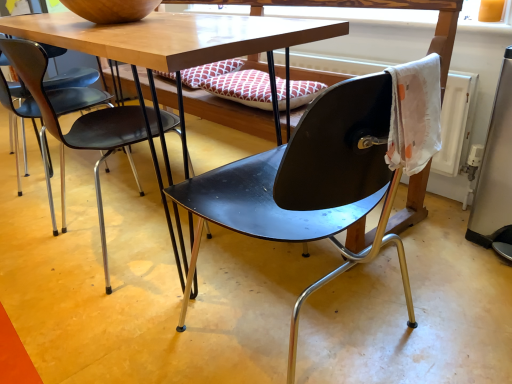
The image size is (512, 384). I want to click on free space in front of matte black chair at center, the 2th chair in the right-to-left sequence, so click(97, 311).